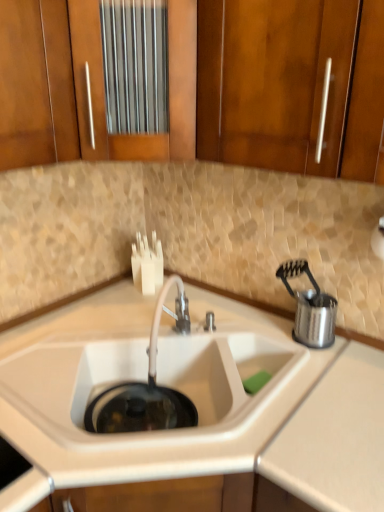
Describe the element at coordinates (48, 81) in the screenshot. I see `wooden cabinet at upper center, acting as the second cabinetry starting from the left` at that location.

The height and width of the screenshot is (512, 384). Describe the element at coordinates (310, 308) in the screenshot. I see `stainless steel utensil holder at right` at that location.

Where is `stainless steel utensil holder at right`? The height and width of the screenshot is (512, 384). stainless steel utensil holder at right is located at coordinates (310, 308).

What do you see at coordinates (159, 321) in the screenshot? I see `satin nickel faucet at center` at bounding box center [159, 321].

This screenshot has height=512, width=384. What are the coordinates of `satin nickel faucet at center` in the screenshot? It's located at (159, 321).

Identify the location of wooden cabinet at upper center, marked as the first cabinetry in a right-to-left arrangement. This screenshot has width=384, height=512. (48, 81).

Consider the image. Is stainless steel utensil holder at right touching white matte sink at center?

They are not placed beside each other.

Is white matte sink at center at the back of stainless steel utensil holder at right?

stainless steel utensil holder at right is not turned away from white matte sink at center.

Locate an element on the screen. sink that appears below the stainless steel utensil holder at right (from the image's perspective) is located at coordinates (158, 360).

From the image's perspective, which object appears higher, wooden cabinet at upper left, the first cabinetry viewed from the left, or wooden cabinet at upper center, marked as the first cabinetry in a right-to-left arrangement?

wooden cabinet at upper center, marked as the first cabinetry in a right-to-left arrangement, from the image's perspective.

Does point (68, 97) come farther from viewer compared to point (45, 55)?

Yes, it is behind point (45, 55).

Is wooden cabinet at upper left, the second cabinetry when ordered from right to left, facing away from wooden cabinet at upper center, marked as the first cabinetry in a right-to-left arrangement?

No.

How far apart are wooden cabinet at upper left, the first cabinetry viewed from the left, and wooden cabinet at upper center, acting as the second cabinetry starting from the left?

The distance of wooden cabinet at upper left, the first cabinetry viewed from the left, from wooden cabinet at upper center, acting as the second cabinetry starting from the left, is 1.40 inches.

From their relative heights in the image, would you say wooden cabinet at upper left, the second cabinetry when ordered from right to left, is taller or shorter than white matte sink at center?

wooden cabinet at upper left, the second cabinetry when ordered from right to left, is taller than white matte sink at center.

From the image's perspective, which object appears higher, wooden cabinet at upper left, the second cabinetry when ordered from right to left, or white matte sink at center?

wooden cabinet at upper left, the second cabinetry when ordered from right to left, from the image's perspective.

How many degrees apart are the facing directions of wooden cabinet at upper left, the second cabinetry when ordered from right to left, and white matte sink at center?

The angle between the facing direction of wooden cabinet at upper left, the second cabinetry when ordered from right to left, and the facing direction of white matte sink at center is 90.8 degrees.

Is wooden cabinet at upper left, the first cabinetry viewed from the left, bigger or smaller than white matte sink at center?

Considering their sizes, wooden cabinet at upper left, the first cabinetry viewed from the left, takes up less space than white matte sink at center.

Is satin nickel faucet at center to the right of wooden cabinet at upper center, marked as the first cabinetry in a right-to-left arrangement, from the viewer's perspective?

Indeed, satin nickel faucet at center is positioned on the right side of wooden cabinet at upper center, marked as the first cabinetry in a right-to-left arrangement.

Who is taller, satin nickel faucet at center or wooden cabinet at upper center, marked as the first cabinetry in a right-to-left arrangement?

With more height is wooden cabinet at upper center, marked as the first cabinetry in a right-to-left arrangement.

Is satin nickel faucet at center in contact with wooden cabinet at upper center, acting as the second cabinetry starting from the left?

satin nickel faucet at center and wooden cabinet at upper center, acting as the second cabinetry starting from the left, are clearly separated.

The image size is (384, 512). In order to click on cabinetry that is the 1st one when counting leftward from the satin nickel faucet at center in this screenshot , I will do `click(48, 81)`.

Considering the relative sizes of wooden cabinet at upper left, the first cabinetry viewed from the left, and satin nickel faucet at center in the image provided, is wooden cabinet at upper left, the first cabinetry viewed from the left, taller than satin nickel faucet at center?

Correct, wooden cabinet at upper left, the first cabinetry viewed from the left, is much taller as satin nickel faucet at center.

From the image's perspective, which one is positioned higher, wooden cabinet at upper left, the first cabinetry viewed from the left, or satin nickel faucet at center?

wooden cabinet at upper left, the first cabinetry viewed from the left, from the image's perspective.

Does wooden cabinet at upper left, the second cabinetry when ordered from right to left, appear on the right side of satin nickel faucet at center?

No, wooden cabinet at upper left, the second cabinetry when ordered from right to left, is not to the right of satin nickel faucet at center.

Does white matte sink at center turn towards wooden cabinet at upper center, acting as the second cabinetry starting from the left?

No, white matte sink at center is not turned towards wooden cabinet at upper center, acting as the second cabinetry starting from the left.

Could you measure the distance between white matte sink at center and wooden cabinet at upper center, acting as the second cabinetry starting from the left?

white matte sink at center and wooden cabinet at upper center, acting as the second cabinetry starting from the left, are 25.87 inches apart.

In terms of height, does white matte sink at center look taller or shorter compared to wooden cabinet at upper center, marked as the first cabinetry in a right-to-left arrangement?

Clearly, white matte sink at center is shorter compared to wooden cabinet at upper center, marked as the first cabinetry in a right-to-left arrangement.

Is white matte sink at center thinner than wooden cabinet at upper center, acting as the second cabinetry starting from the left?

In fact, white matte sink at center might be wider than wooden cabinet at upper center, acting as the second cabinetry starting from the left.

Consider the image. Is stainless steel utensil holder at right in contact with wooden cabinet at upper left, the second cabinetry when ordered from right to left?

No, stainless steel utensil holder at right is not making contact with wooden cabinet at upper left, the second cabinetry when ordered from right to left.

Is stainless steel utensil holder at right positioned with its back to wooden cabinet at upper left, the first cabinetry viewed from the left?

No, stainless steel utensil holder at right's orientation is not away from wooden cabinet at upper left, the first cabinetry viewed from the left.

Who is smaller, stainless steel utensil holder at right or wooden cabinet at upper left, the first cabinetry viewed from the left?

stainless steel utensil holder at right.

In the scene shown: From a real-world perspective, which object stands above the other?

wooden cabinet at upper left, the second cabinetry when ordered from right to left, from a real-world perspective.

The image size is (384, 512). Find the location of `appliance to the right of white matte sink at center`. appliance to the right of white matte sink at center is located at coordinates (310, 308).

Where is `cabinetry above the wooden cabinet at upper left, the first cabinetry viewed from the left (from a real-world perspective)`? Image resolution: width=384 pixels, height=512 pixels. cabinetry above the wooden cabinet at upper left, the first cabinetry viewed from the left (from a real-world perspective) is located at coordinates (48, 81).

When comparing their distances from wooden cabinet at upper left, the second cabinetry when ordered from right to left, does white matte sink at center or wooden cabinet at upper center, acting as the second cabinetry starting from the left, seem closer?

wooden cabinet at upper center, acting as the second cabinetry starting from the left, is positioned closer to the anchor wooden cabinet at upper left, the second cabinetry when ordered from right to left.

When comparing their distances from wooden cabinet at upper left, the second cabinetry when ordered from right to left, does wooden cabinet at upper center, marked as the first cabinetry in a right-to-left arrangement, or stainless steel utensil holder at right seem closer?

Among the two, wooden cabinet at upper center, marked as the first cabinetry in a right-to-left arrangement, is located nearer to wooden cabinet at upper left, the second cabinetry when ordered from right to left.

From the image, which object appears to be farther from white matte sink at center, wooden cabinet at upper left, the first cabinetry viewed from the left, or wooden cabinet at upper center, marked as the first cabinetry in a right-to-left arrangement?

wooden cabinet at upper left, the first cabinetry viewed from the left, is further to white matte sink at center.

When comparing their distances from wooden cabinet at upper center, acting as the second cabinetry starting from the left, does satin nickel faucet at center or wooden cabinet at upper left, the first cabinetry viewed from the left, seem closer?

Among the two, wooden cabinet at upper left, the first cabinetry viewed from the left, is located nearer to wooden cabinet at upper center, acting as the second cabinetry starting from the left.

Estimate the real-world distances between objects in this image. Which object is closer to satin nickel faucet at center, white matte sink at center or stainless steel utensil holder at right?

white matte sink at center is positioned closer to the anchor satin nickel faucet at center.

Based on the photo, when comparing their distances from stainless steel utensil holder at right, does wooden cabinet at upper center, acting as the second cabinetry starting from the left, or wooden cabinet at upper left, the first cabinetry viewed from the left, seem further?

wooden cabinet at upper left, the first cabinetry viewed from the left, is positioned further to the anchor stainless steel utensil holder at right.

Estimate the real-world distances between objects in this image. Which object is further from wooden cabinet at upper left, the first cabinetry viewed from the left, satin nickel faucet at center or white matte sink at center?

Based on the image, white matte sink at center appears to be further to wooden cabinet at upper left, the first cabinetry viewed from the left.

When comparing their distances from stainless steel utensil holder at right, does white matte sink at center or wooden cabinet at upper left, the second cabinetry when ordered from right to left, seem closer?

white matte sink at center is closer to stainless steel utensil holder at right.

Identify the location of tap situated between white matte sink at center and stainless steel utensil holder at right from left to right. (159, 321).

The height and width of the screenshot is (512, 384). I want to click on sink between wooden cabinet at upper left, the first cabinetry viewed from the left, and stainless steel utensil holder at right, in the horizontal direction, so point(158,360).

The height and width of the screenshot is (512, 384). Identify the location of tap that lies between wooden cabinet at upper left, the second cabinetry when ordered from right to left, and white matte sink at center from top to bottom. (159, 321).

The height and width of the screenshot is (512, 384). Find the location of `cabinetry between wooden cabinet at upper center, acting as the second cabinetry starting from the left, and white matte sink at center from top to bottom`. cabinetry between wooden cabinet at upper center, acting as the second cabinetry starting from the left, and white matte sink at center from top to bottom is located at coordinates (36, 85).